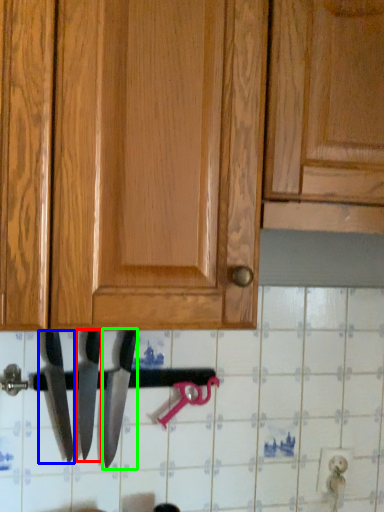
Question: Which is farther away from knife (highlighted by a red box)? knife (highlighted by a blue box) or knife (highlighted by a green box)?

Choices:
 (A) knife
 (B) knife

Answer: (A)